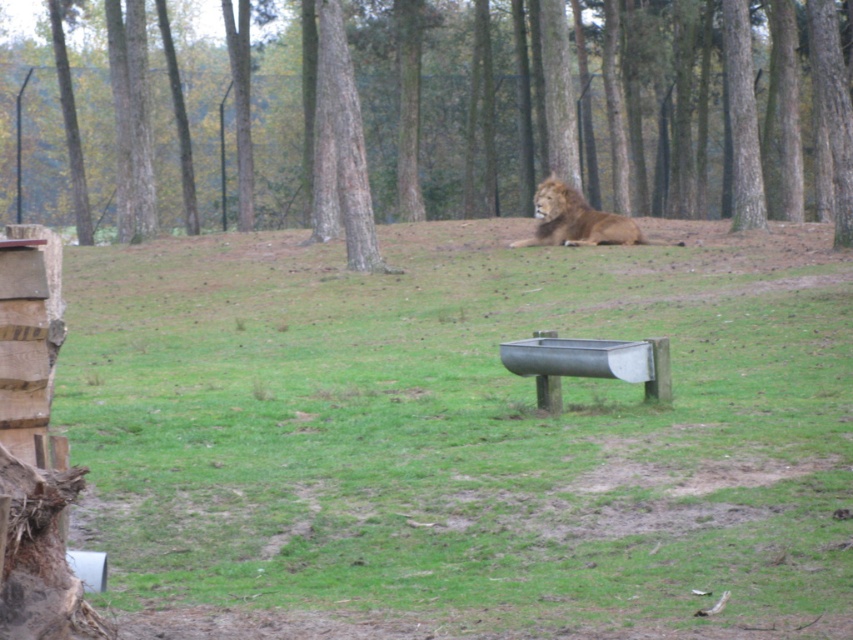
Can you confirm if brown wood tree at center is smaller than golden fur lion at center?

No.

Find the location of `brown wood tree at center`. brown wood tree at center is located at coordinates (415, 116).

From the picture: Can you confirm if green grassy at center is positioned to the left of brown wood tree at center?

In fact, green grassy at center is to the right of brown wood tree at center.

Does point (450, 470) lie in front of point (404, 202)?

Yes.

Is point (374, 300) behind point (819, 60)?

No, it is not.

Where is `green grassy at center`? The image size is (853, 640). green grassy at center is located at coordinates (462, 435).

Locate an element on the screen. This screenshot has width=853, height=640. green grassy at center is located at coordinates click(x=462, y=435).

This screenshot has width=853, height=640. Describe the element at coordinates (462, 435) in the screenshot. I see `green grassy at center` at that location.

Find the location of `green grassy at center`. green grassy at center is located at coordinates (x=462, y=435).